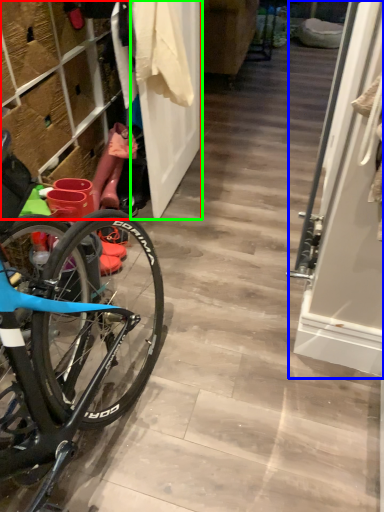
Question: Considering the real-world distances, which object is closest to closet (highlighted by a red box)? screen door (highlighted by a blue box) or door (highlighted by a green box).

Choices:
 (A) screen door
 (B) door

Answer: (B)